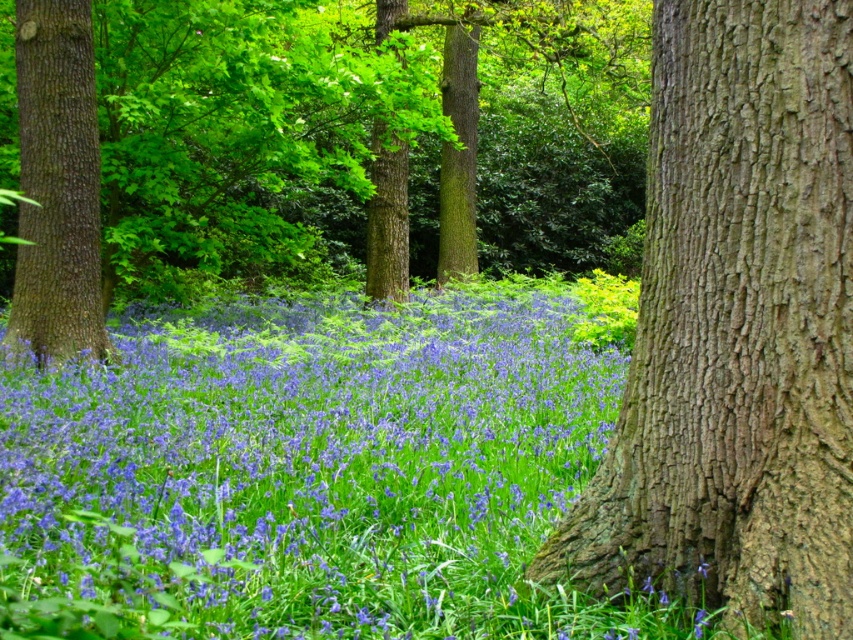
Is point (88, 452) positioned after point (675, 180)?

Yes, it is.

Who is higher up, blue matte flowers at center or smooth brown bark at center?

smooth brown bark at center is above.

Is point (410, 468) in front of point (728, 97)?

No, (410, 468) is behind (728, 97).

Identify the location of blue matte flowers at center. This screenshot has height=640, width=853. pyautogui.click(x=321, y=465).

Which is above, smooth brown bark at center or smooth brown tree trunk at left?

Positioned higher is smooth brown tree trunk at left.

Who is shorter, smooth brown bark at center or smooth brown tree trunk at left?

Standing shorter between the two is smooth brown bark at center.

Identify the location of smooth brown bark at center. The image size is (853, 640). (735, 326).

Is point (450, 464) behind point (33, 54)?

No, it is in front of (33, 54).

Is point (247, 484) in front of point (56, 323)?

Yes, point (247, 484) is closer to viewer.

Identify the location of blue matte flowers at center. The height and width of the screenshot is (640, 853). (321, 465).